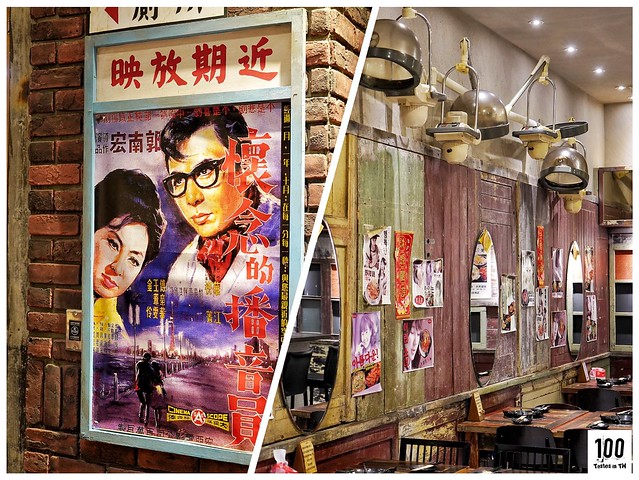
Where is `3 tables partially shown`? 3 tables partially shown is located at coordinates (408, 466), (553, 413), (620, 382).